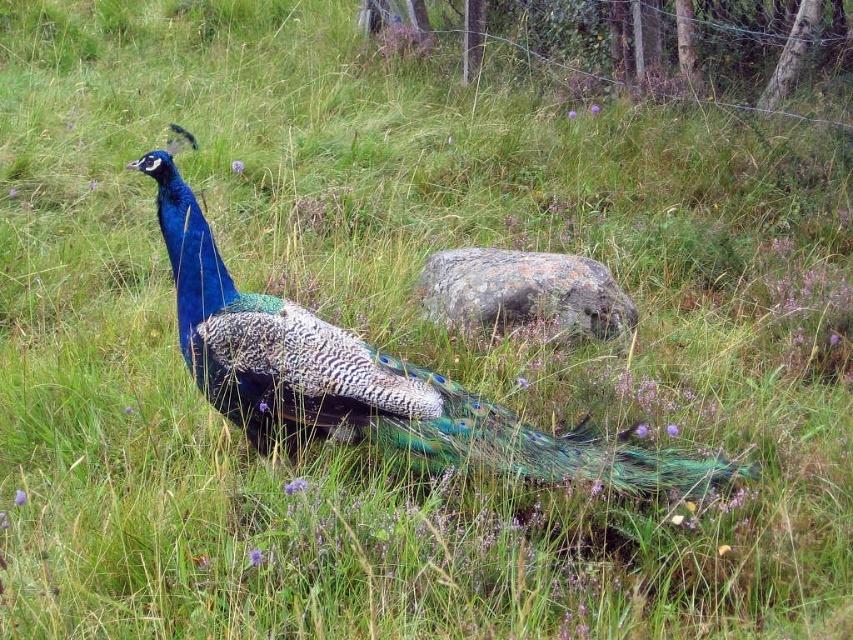
In the scene shown: You are standing in a grassy field with a shiny blue peacock at center. You want to take a photo of the peacock without any obstructions. The camera you have can focus on objects up to 2.5 meters away. Will the peacock be in focus?

The shiny blue peacock at center is 2.40 meters from viewer, so yes, the peacock will be in focus since it is within the camera focus range of up to 2.5 meters.

Consider the image. You are a photographer trying to capture the shiny blue peacock at center and the gray rough rock at center in the same frame. Based on their positions, which object is closer to the left edge of the photo?

The shiny blue peacock at center is closer to the left edge of the photo because it is positioned to the left of the gray rough rock at center.